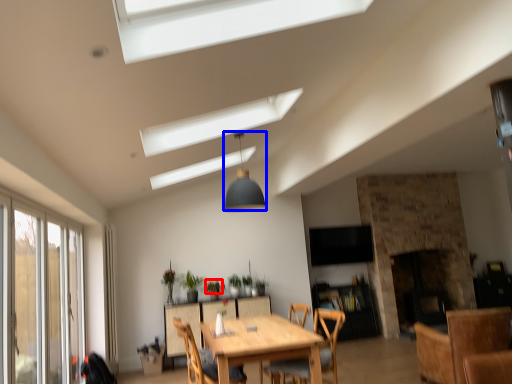
Question: Which object appears farthest to the camera in this image, plant (highlighted by a red box) or light fixture (highlighted by a blue box)?

Choices:
 (A) plant
 (B) light fixture

Answer: (A)